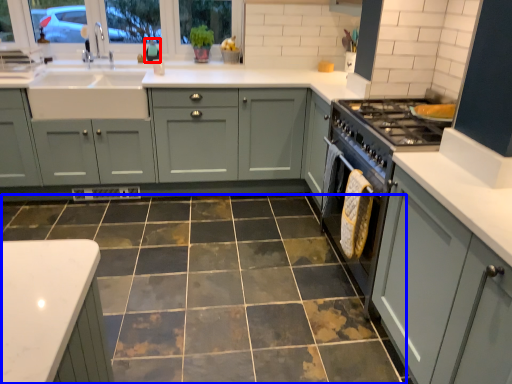
Question: Among these objects, which one is nearest to the camera, teal (highlighted by a red box) or ceramic tile (highlighted by a blue box)?

Choices:
 (A) teal
 (B) ceramic tile

Answer: (B)